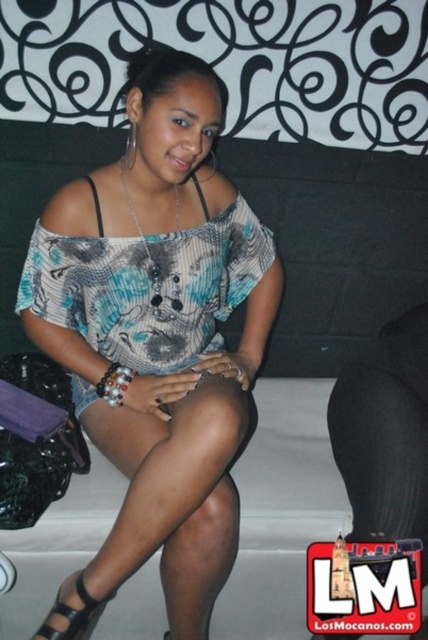
Question: Which point is farther from the camera taking this photo?

Choices:
 (A) (171, 282)
 (B) (216, 264)
 (C) (86, 634)

Answer: (C)

Question: Can you confirm if printed fabric blouse at center is positioned to the right of printed fabric dress at center?

Choices:
 (A) yes
 (B) no

Answer: (A)

Question: Among these points, which one is farthest from the camera?

Choices:
 (A) (62, 612)
 (B) (184, 237)

Answer: (B)

Question: Which point is closer to the camera?

Choices:
 (A) (130, 269)
 (B) (74, 314)

Answer: (A)

Question: In this image, where is printed fabric blouse at center located relative to printed fabric dress at center?

Choices:
 (A) right
 (B) left

Answer: (A)

Question: Can you confirm if printed fabric blouse at center is smaller than black leather sandal at lower left?

Choices:
 (A) no
 (B) yes

Answer: (A)